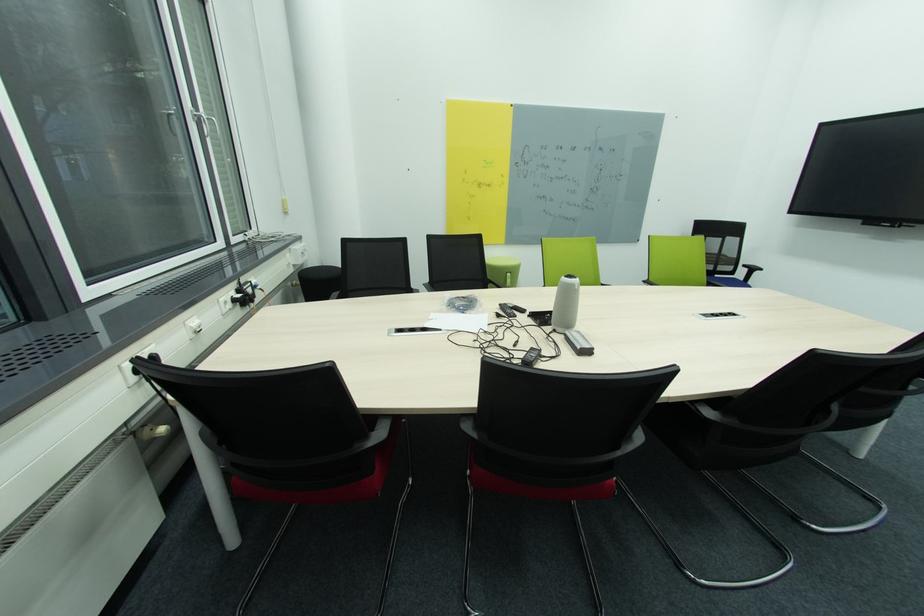
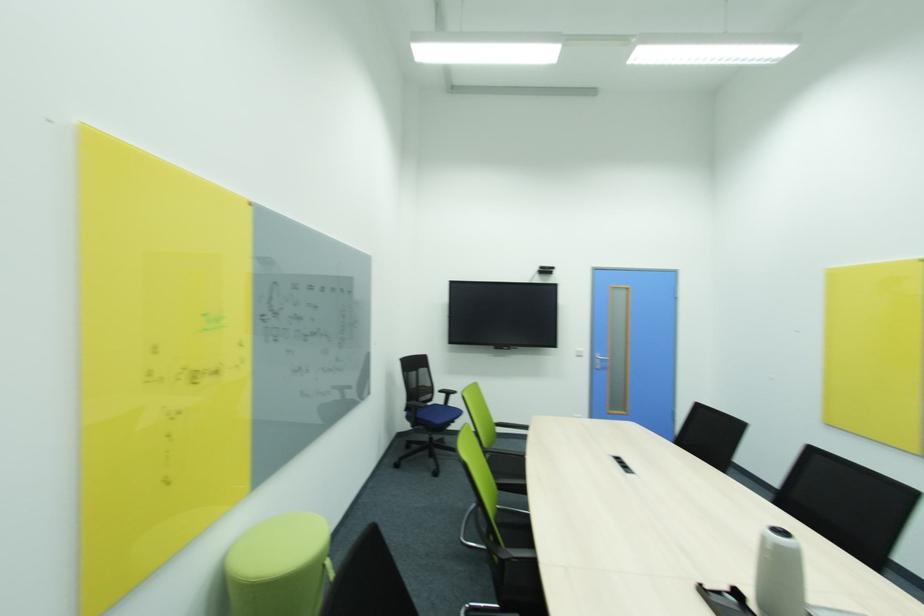
In the second image, find the point that corresponds to the point at 736,241 in the first image.

(428, 371)